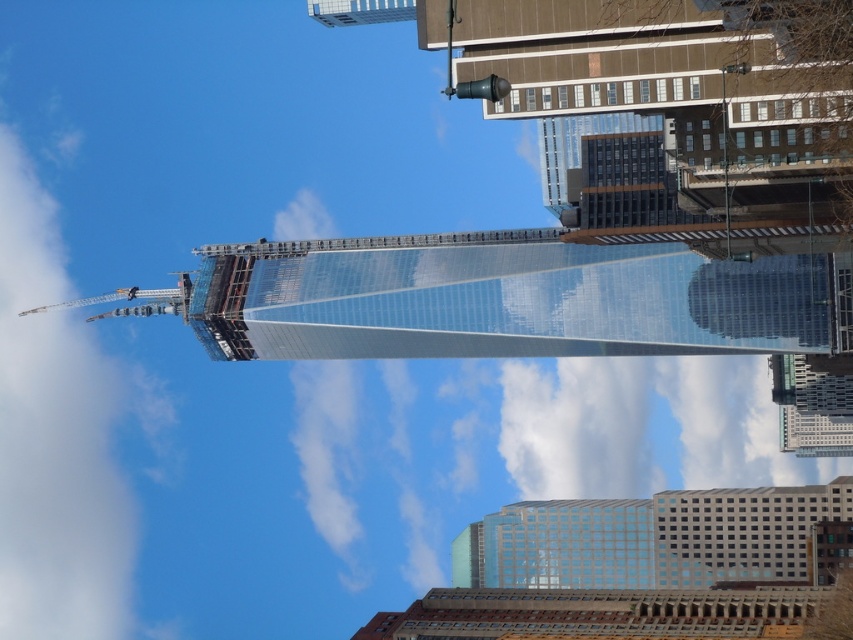
Can you confirm if white glass building at lower right is thinner than metallic silver crane at upper left?

Indeed, white glass building at lower right has a lesser width compared to metallic silver crane at upper left.

Who is shorter, white glass building at lower right or metallic silver crane at upper left?

Standing shorter between the two is metallic silver crane at upper left.

Between point (804, 579) and point (94, 301), which one is positioned in front?

Point (804, 579)

What are the coordinates of `white glass building at lower right` in the screenshot? It's located at (743, 532).

The image size is (853, 640). I want to click on transparent glass building at right, so click(x=764, y=298).

Identify the location of transparent glass building at right. (764, 298).

Is white glass building at lower right wider than transparent glass building at right?

Yes.

Which is behind, point (791, 506) or point (708, 269)?

The point (708, 269) is behind.

Which is behind, point (706, 536) or point (808, 308)?

The point (706, 536) is behind.

Identify the location of white glass building at lower right. (743, 532).